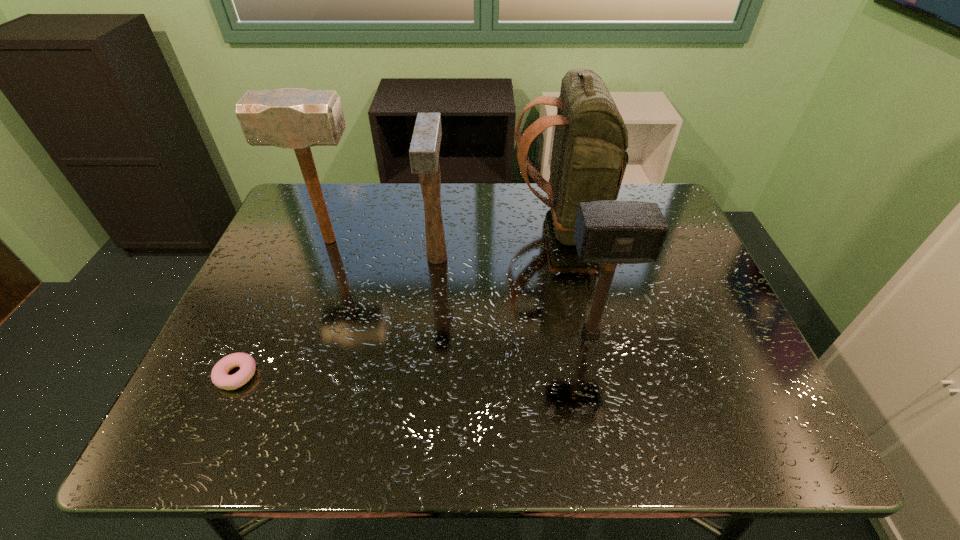
Locate an element on the screen. Image resolution: width=960 pixels, height=540 pixels. vacant space located on the striking face of the leftmost mallet is located at coordinates (513, 241).

Locate an element on the screen. vacant region located on the right of the second mallet from left to right is located at coordinates (595, 258).

The image size is (960, 540). Find the location of `vacant region located on the right of the nearest mallet`. vacant region located on the right of the nearest mallet is located at coordinates (716, 334).

Locate an element on the screen. The image size is (960, 540). blank space located 0.130m on the right of the shortest object is located at coordinates (321, 375).

Locate an element on the screen. The height and width of the screenshot is (540, 960). backpack that is at the far edge is located at coordinates (589, 157).

Where is `mallet at the far edge`? mallet at the far edge is located at coordinates (290, 118).

Image resolution: width=960 pixels, height=540 pixels. What are the coordinates of `mallet present at the left edge` in the screenshot? It's located at (290, 118).

Locate an element on the screen. The image size is (960, 540). doughnut positioned at the left edge is located at coordinates (219, 375).

In order to click on object that is positioned at the far left corner in this screenshot , I will do `click(290, 118)`.

The width and height of the screenshot is (960, 540). What are the coordinates of `vacant space at the far edge of the desktop` in the screenshot? It's located at (471, 199).